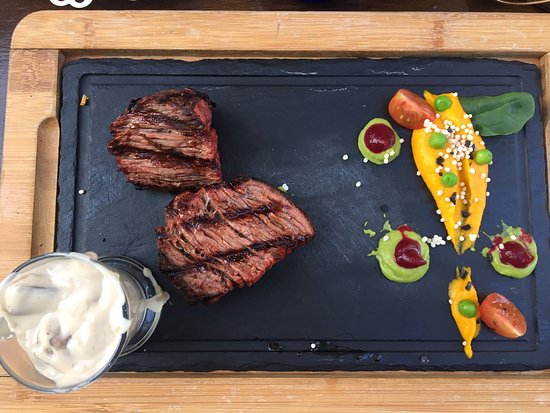
The width and height of the screenshot is (550, 413). Find the location of `wooden tray`. wooden tray is located at coordinates (341, 32), (33, 106), (20, 214), (231, 396), (446, 394).